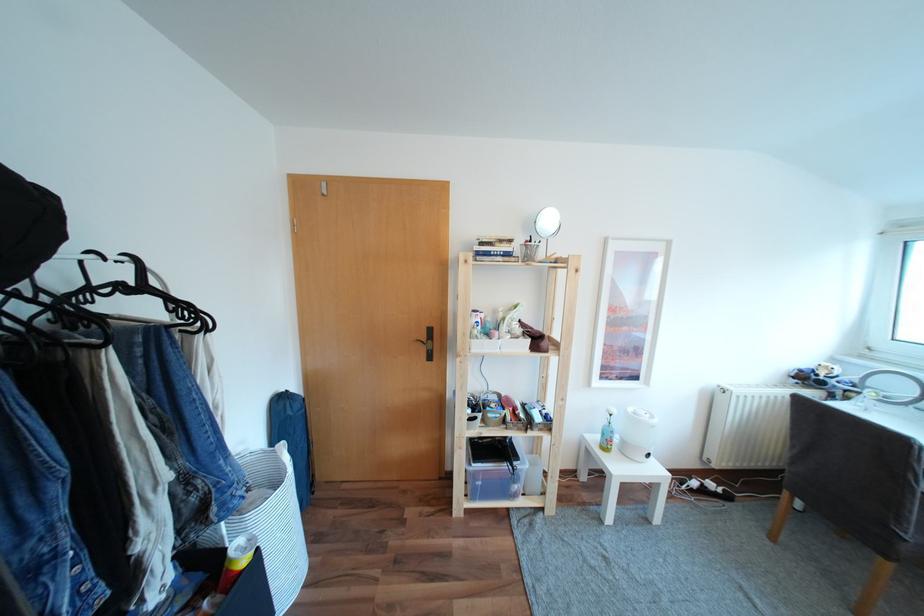
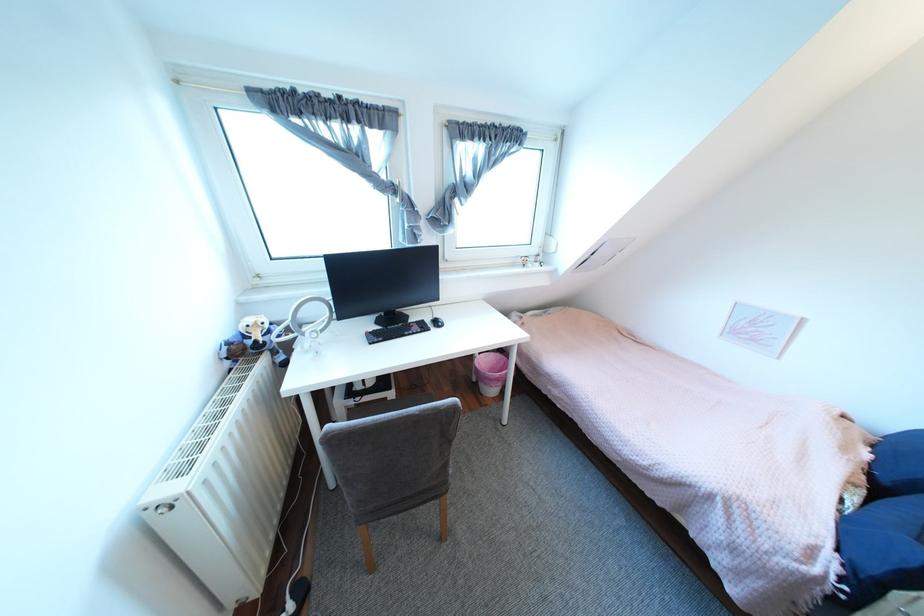
Find the pixel in the second image that matches (x=810, y=371) in the first image.

(239, 342)